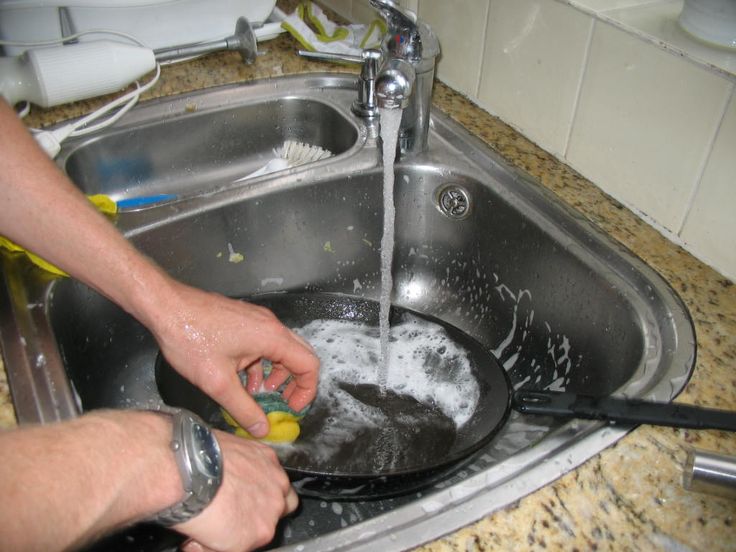
The height and width of the screenshot is (552, 736). I want to click on immersion blender, so click(x=308, y=150), click(x=77, y=68).